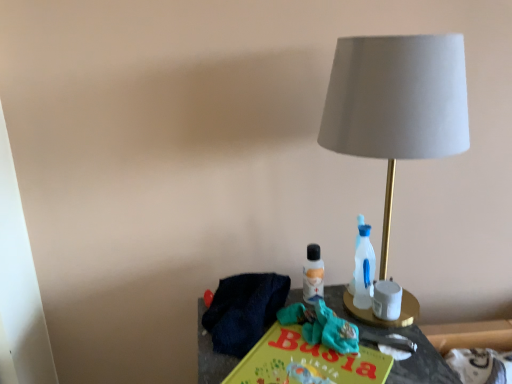
Locate an element on the screen. vacant region to the right of teal fabric scrub at center is located at coordinates (389, 345).